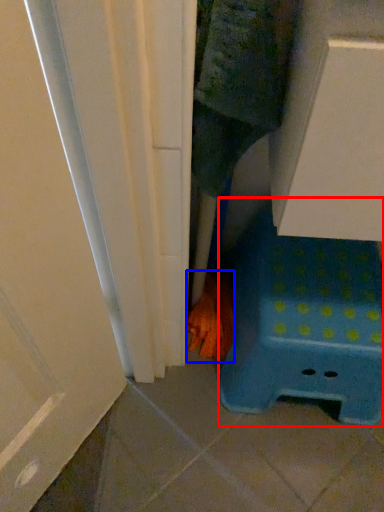
Question: Which object is further to the camera taking this photo, furniture (highlighted by a red box) or hand (highlighted by a blue box)?

Choices:
 (A) furniture
 (B) hand

Answer: (B)